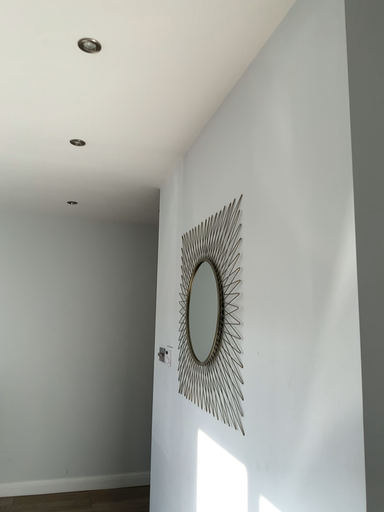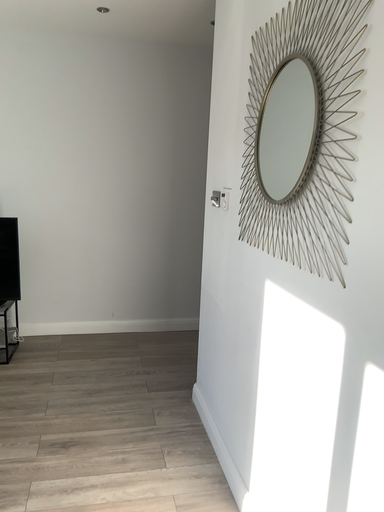
Question: Which way did the camera rotate in the video?

Choices:
 (A) rotated upward
 (B) rotated downward

Answer: (B)